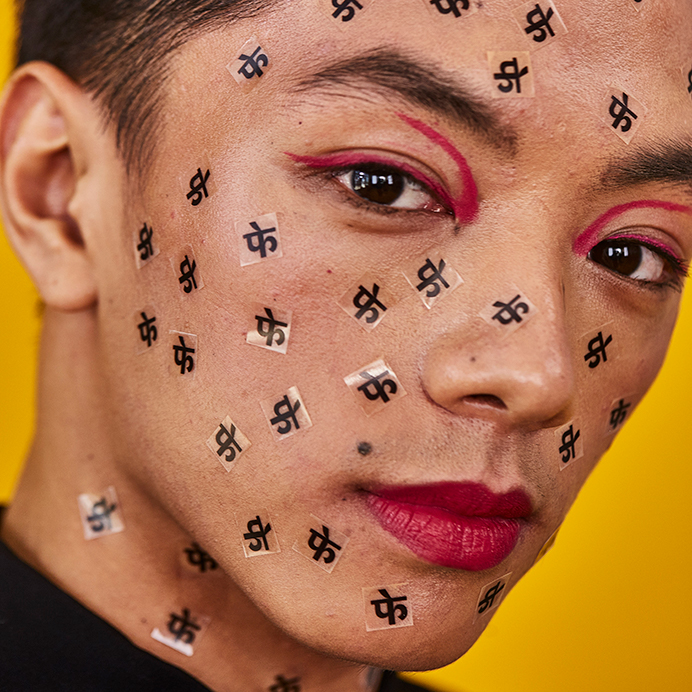
Locate an element on the screen. The width and height of the screenshot is (692, 692). sticker is located at coordinates (388, 612).